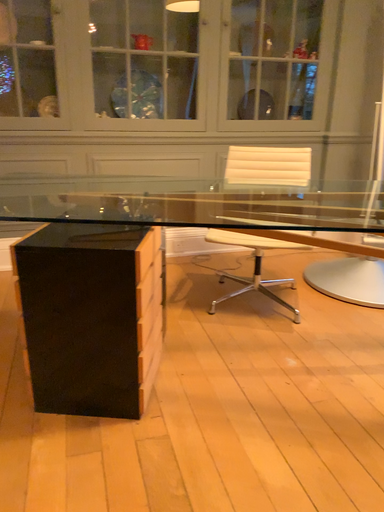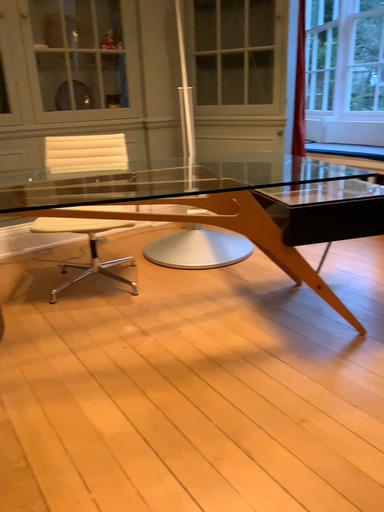
Question: How did the camera likely rotate when shooting the video?

Choices:
 (A) rotated left
 (B) rotated right

Answer: (B)